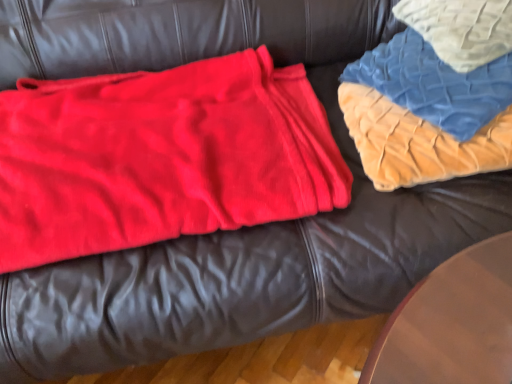
Question: Considering the relative sizes of velvet quilt at upper right and matte red blanket at left in the image provided, is velvet quilt at upper right wider than matte red blanket at left?

Choices:
 (A) yes
 (B) no

Answer: (B)

Question: From a real-world perspective, is velvet quilt at upper right on top of matte red blanket at left?

Choices:
 (A) no
 (B) yes

Answer: (B)

Question: Is velvet quilt at upper right facing away from matte red blanket at left?

Choices:
 (A) no
 (B) yes

Answer: (A)

Question: Is the depth of velvet quilt at upper right greater than that of matte red blanket at left?

Choices:
 (A) yes
 (B) no

Answer: (A)

Question: Considering the relative sizes of velvet quilt at upper right and matte red blanket at left in the image provided, is velvet quilt at upper right taller than matte red blanket at left?

Choices:
 (A) no
 (B) yes

Answer: (B)

Question: Could matte red blanket at left be considered to be inside velvet quilt at upper right?

Choices:
 (A) yes
 (B) no

Answer: (B)

Question: Are matte red blanket at left and velvet quilt at upper right beside each other?

Choices:
 (A) yes
 (B) no

Answer: (B)

Question: Does matte red blanket at left come behind velvet quilt at upper right?

Choices:
 (A) no
 (B) yes

Answer: (A)

Question: Is matte red blanket at left bigger than velvet quilt at upper right?

Choices:
 (A) no
 (B) yes

Answer: (B)

Question: From a real-world perspective, is matte red blanket at left on velvet quilt at upper right?

Choices:
 (A) no
 (B) yes

Answer: (A)

Question: Does matte red blanket at left have a lesser width compared to velvet quilt at upper right?

Choices:
 (A) yes
 (B) no

Answer: (B)

Question: Is matte red blanket at left at the right side of velvet quilt at upper right?

Choices:
 (A) yes
 (B) no

Answer: (B)

Question: Is blue quilted fabric at upper right aimed at velvet quilt at upper right?

Choices:
 (A) no
 (B) yes

Answer: (B)